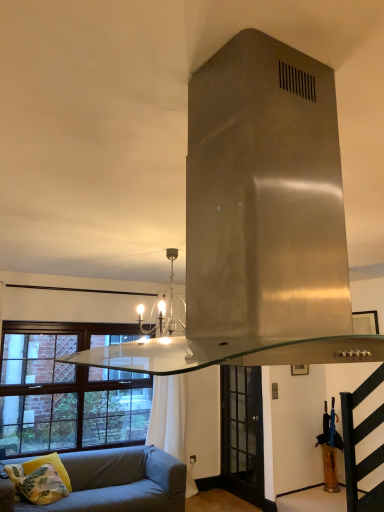
Question: Considering the relative positions of brown wooden window at lower left and yellow floral pillow at lower left, marked as the second pillow in a right-to-left arrangement, in the image provided, is brown wooden window at lower left to the left of yellow floral pillow at lower left, marked as the second pillow in a right-to-left arrangement, from the viewer's perspective?

Choices:
 (A) no
 (B) yes

Answer: (A)

Question: Could yellow floral pillow at lower left, marked as the 1th pillow in a left-to-right arrangement, be considered to be inside brown wooden window at lower left?

Choices:
 (A) no
 (B) yes

Answer: (A)

Question: From a real-world perspective, is brown wooden window at lower left positioned under yellow floral pillow at lower left, marked as the second pillow in a right-to-left arrangement, based on gravity?

Choices:
 (A) no
 (B) yes

Answer: (A)

Question: Can you confirm if brown wooden window at lower left is smaller than yellow floral pillow at lower left, marked as the 1th pillow in a left-to-right arrangement?

Choices:
 (A) yes
 (B) no

Answer: (B)

Question: Is brown wooden window at lower left shorter than yellow floral pillow at lower left, marked as the second pillow in a right-to-left arrangement?

Choices:
 (A) yes
 (B) no

Answer: (B)

Question: Is the depth of brown wooden window at lower left less than that of yellow floral pillow at lower left, marked as the second pillow in a right-to-left arrangement?

Choices:
 (A) no
 (B) yes

Answer: (A)

Question: Considering the relative sizes of brown wooden window at lower left and clear glass door at center in the image provided, is brown wooden window at lower left shorter than clear glass door at center?

Choices:
 (A) yes
 (B) no

Answer: (A)

Question: Does brown wooden window at lower left turn towards clear glass door at center?

Choices:
 (A) no
 (B) yes

Answer: (A)

Question: Is the position of brown wooden window at lower left less distant than that of clear glass door at center?

Choices:
 (A) yes
 (B) no

Answer: (A)

Question: Is brown wooden window at lower left to the right of clear glass door at center from the viewer's perspective?

Choices:
 (A) no
 (B) yes

Answer: (A)

Question: Does brown wooden window at lower left have a smaller size compared to clear glass door at center?

Choices:
 (A) yes
 (B) no

Answer: (B)

Question: From a real-world perspective, is brown wooden window at lower left located higher than clear glass door at center?

Choices:
 (A) yes
 (B) no

Answer: (A)

Question: Is light blue fabric studio couch at lower left to the left of matte black chandelier at center from the viewer's perspective?

Choices:
 (A) yes
 (B) no

Answer: (A)